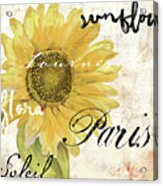
At what (x,y) coordinates should I click in order to perform the action: click on white canvas. Please return your answer as a coordinate pair (x, y). This screenshot has width=163, height=186. Looking at the image, I should click on (118, 122).